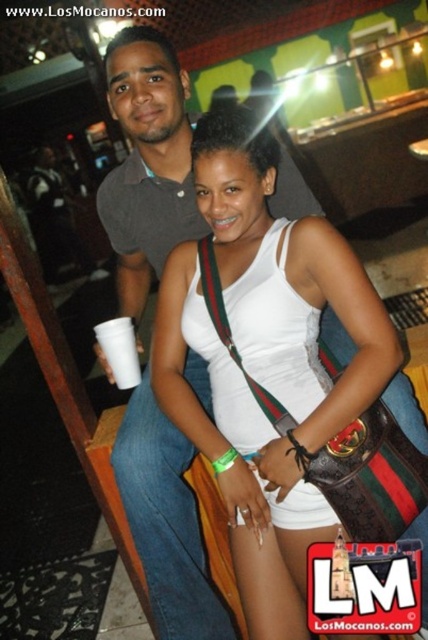
Question: Which object is the farthest from the gray cotton shirt at upper left?

Choices:
 (A) white matte tank top at center
 (B) white paper cup at lower left

Answer: (B)

Question: In this image, where is gray cotton shirt at upper left located relative to white paper cup at lower left?

Choices:
 (A) left
 (B) right

Answer: (B)

Question: Does gray cotton shirt at upper left appear over white paper cup at lower left?

Choices:
 (A) yes
 (B) no

Answer: (B)

Question: Based on their relative distances, which object is farther from the gray cotton shirt at upper left?

Choices:
 (A) white paper cup at lower left
 (B) white matte tank top at center

Answer: (A)

Question: Which object is farther from the camera taking this photo?

Choices:
 (A) white paper cup at lower left
 (B) white matte tank top at center
 (C) gray cotton shirt at upper left

Answer: (A)

Question: Is gray cotton shirt at upper left positioned at the back of white paper cup at lower left?

Choices:
 (A) yes
 (B) no

Answer: (B)